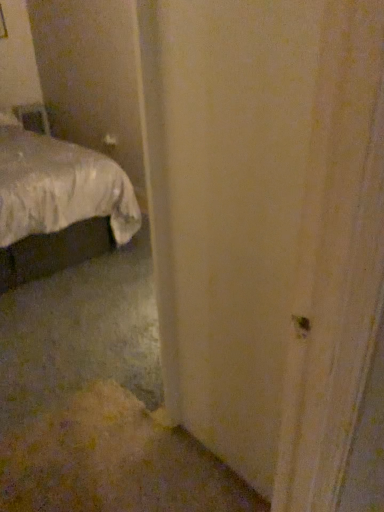
Describe the element at coordinates (57, 204) in the screenshot. The image size is (384, 512). I see `white satin bed at left` at that location.

The width and height of the screenshot is (384, 512). In order to click on white satin bed at left in this screenshot , I will do `click(57, 204)`.

At what (x,y) coordinates should I click in order to perform the action: click on white satin bed at left. Please return your answer as a coordinate pair (x, y). This screenshot has width=384, height=512. Looking at the image, I should click on (57, 204).